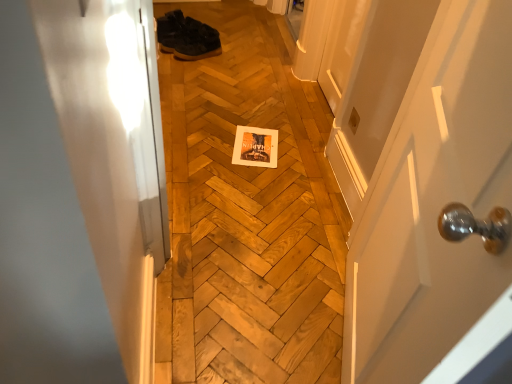
I want to click on white glossy door at center, so [x=434, y=202].

Describe the element at coordinates (187, 37) in the screenshot. I see `dark brown leather shoes at upper center` at that location.

What is the approximate height of wooden at center?

wooden at center is 1.29 inches tall.

Find the location of a particular element. The image size is (512, 384). white glossy door at center is located at coordinates (434, 202).

Is wooden at center not inside dark brown leather shoes at upper center?

wooden at center is positioned outside dark brown leather shoes at upper center.

Measure the distance between wooden at center and dark brown leather shoes at upper center.

wooden at center and dark brown leather shoes at upper center are 25.81 inches apart.

Considering the positions of objects wooden at center and dark brown leather shoes at upper center in the image provided, who is in front, wooden at center or dark brown leather shoes at upper center?

wooden at center.

From a real-world perspective, which object rests below the other?

wooden at center, from a real-world perspective.

Does dark brown leather shoes at upper center turn towards white glossy door at center?

Yes, dark brown leather shoes at upper center is aimed at white glossy door at center.

Is dark brown leather shoes at upper center not within white glossy door at center?

Yes, dark brown leather shoes at upper center is outside of white glossy door at center.

Is dark brown leather shoes at upper center far from white glossy door at center?

Absolutely, dark brown leather shoes at upper center is distant from white glossy door at center.

Between dark brown leather shoes at upper center and white glossy door at center, which one has more height?

Standing taller between the two is white glossy door at center.

From the image's perspective, is dark brown leather shoes at upper center above or below wooden at center?

dark brown leather shoes at upper center is above wooden at center.

In terms of height, does dark brown leather shoes at upper center look taller or shorter compared to wooden at center?

Clearly, dark brown leather shoes at upper center is taller compared to wooden at center.

Who is smaller, dark brown leather shoes at upper center or wooden at center?

Smaller between the two is dark brown leather shoes at upper center.

Is point (225, 359) in front of point (481, 8)?

No, (225, 359) is behind (481, 8).

What's the angular difference between wooden at center and white glossy door at center's facing directions?

There is a 114-degree angle between the facing directions of wooden at center and white glossy door at center.

Is white glossy door at center completely or partially inside wooden at center?

No, white glossy door at center is located outside of wooden at center.

Identify the location of door located above the wooden at center (from a real-world perspective). (434, 202).

From the image's perspective, is white glossy door at center located above or below dark brown leather shoes at upper center?

white glossy door at center is situated lower than dark brown leather shoes at upper center in the image.

Is white glossy door at center facing towards dark brown leather shoes at upper center?

No, white glossy door at center is not aimed at dark brown leather shoes at upper center.

From the picture: Is white glossy door at center positioned far away from dark brown leather shoes at upper center?

Yes.

Is white glossy door at center turned away from wooden at center?

white glossy door at center is not turned away from wooden at center.

Considering the relative sizes of white glossy door at center and wooden at center in the image provided, is white glossy door at center thinner than wooden at center?

Indeed, white glossy door at center has a lesser width compared to wooden at center.

Which point is more distant from viewer, (499, 286) or (257, 195)?

The point (257, 195) is behind.

Who is smaller, white glossy door at center or wooden at center?

wooden at center.

In order to click on plywood below the dark brown leather shoes at upper center (from a real-world perspective) in this screenshot , I will do `click(248, 214)`.

The image size is (512, 384). Identify the location of door in front of the dark brown leather shoes at upper center. tap(434, 202).

Estimate the real-world distances between objects in this image. Which object is closer to white glossy door at center, dark brown leather shoes at upper center or wooden at center?

wooden at center lies closer to white glossy door at center than the other object.

When comparing their distances from dark brown leather shoes at upper center, does white glossy door at center or wooden at center seem further?

white glossy door at center is positioned further to the anchor dark brown leather shoes at upper center.

Consider the image. Which object lies further to the anchor point white glossy door at center, wooden at center or dark brown leather shoes at upper center?

dark brown leather shoes at upper center.

Looking at the image, which one is located closer to dark brown leather shoes at upper center, wooden at center or white glossy door at center?

wooden at center is closer to dark brown leather shoes at upper center.

When comparing their distances from wooden at center, does dark brown leather shoes at upper center or white glossy door at center seem closer?

Based on the image, dark brown leather shoes at upper center appears to be nearer to wooden at center.

Based on their spatial positions, is white glossy door at center or dark brown leather shoes at upper center closer to wooden at center?

dark brown leather shoes at upper center is positioned closer to the anchor wooden at center.

Where is `plywood between white glossy door at center and dark brown leather shoes at upper center along the z-axis`? plywood between white glossy door at center and dark brown leather shoes at upper center along the z-axis is located at coordinates (248, 214).